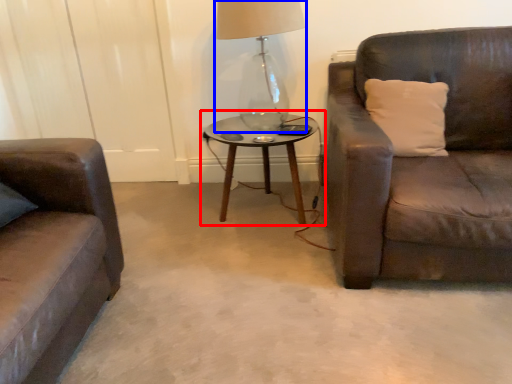
Question: Which point is further to the camera, coffee table (highlighted by a red box) or table lamp (highlighted by a blue box)?

Choices:
 (A) coffee table
 (B) table lamp

Answer: (A)